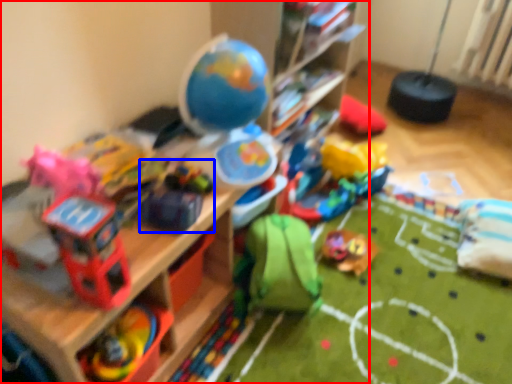
Question: Which object is closer to the camera taking this photo, shelf (highlighted by a red box) or toy (highlighted by a blue box)?

Choices:
 (A) shelf
 (B) toy

Answer: (A)